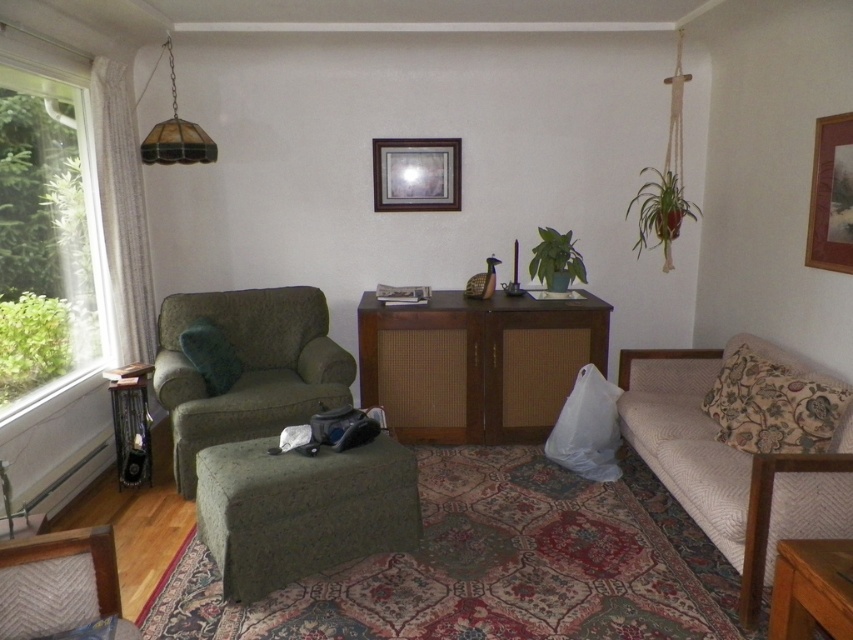
You are standing in the living room and want to place a 2.5 meter long sofa. The sofa needs to be placed such that its front edge is exactly at point (286, 572). Is there enough space behind the sofa to walk comfortably?

The point (286, 572) is 2.67 meters away from the camera. Since the sofa is 2.5 meters long, placing it with its front edge at this point would leave 0.17 meters of space behind it. This is insufficient for comfortable walking, as a minimum of 0.5 meters is typically required. Therefore, there is not enough space behind the sofa.

You are an interior designer assessing the placement of the wooden picture frame at upper center and the stained glass lampshade at upper center. Which object is positioned to the right side of the other?

The wooden picture frame at upper center is to the right of the stained glass lampshade at upper center.